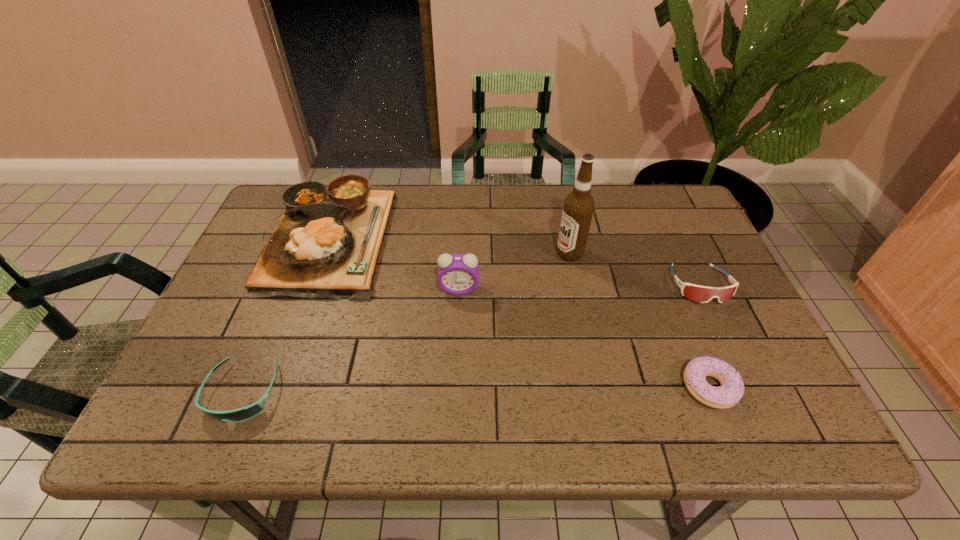
This screenshot has height=540, width=960. I want to click on free space located on the label of the fourth object from left to right, so click(x=509, y=253).

You are a GUI agent. You are given a task and a screenshot of the screen. Output one action in this format:
    pyautogui.click(x=<x>, y=<y>)
    Task: Click on the free location located 0.210m on the face of the alarm clock
    The image size is (960, 540).
    Given the screenshot: What is the action you would take?
    pyautogui.click(x=456, y=368)

Identify the location of vacant space located 0.160m on the front of the fourth shortest object. The image size is (960, 540). (288, 355).

The width and height of the screenshot is (960, 540). Find the location of `vacant area situated on the front-facing side of the third shortest object`. vacant area situated on the front-facing side of the third shortest object is located at coordinates (741, 371).

Find the location of a particular element. This screenshot has width=960, height=540. free space located on the left of the doughnut is located at coordinates (549, 387).

At what (x,y) coordinates should I click in order to perform the action: click on object located at the far edge. Please return your answer as a coordinate pair (x, y). This screenshot has width=960, height=540. Looking at the image, I should click on tap(326, 245).

Locate an element on the screen. sunglasses at the near edge is located at coordinates (241, 414).

This screenshot has height=540, width=960. I want to click on doughnut that is at the near edge, so click(x=727, y=395).

The image size is (960, 540). I want to click on platter located in the left edge section of the desktop, so click(x=326, y=245).

You are a GUI agent. You are given a task and a screenshot of the screen. Output one action in this format:
    pyautogui.click(x=<x>, y=<y>)
    Task: Click on the sunglasses that is at the left edge
    
    Given the screenshot: What is the action you would take?
    pyautogui.click(x=241, y=414)